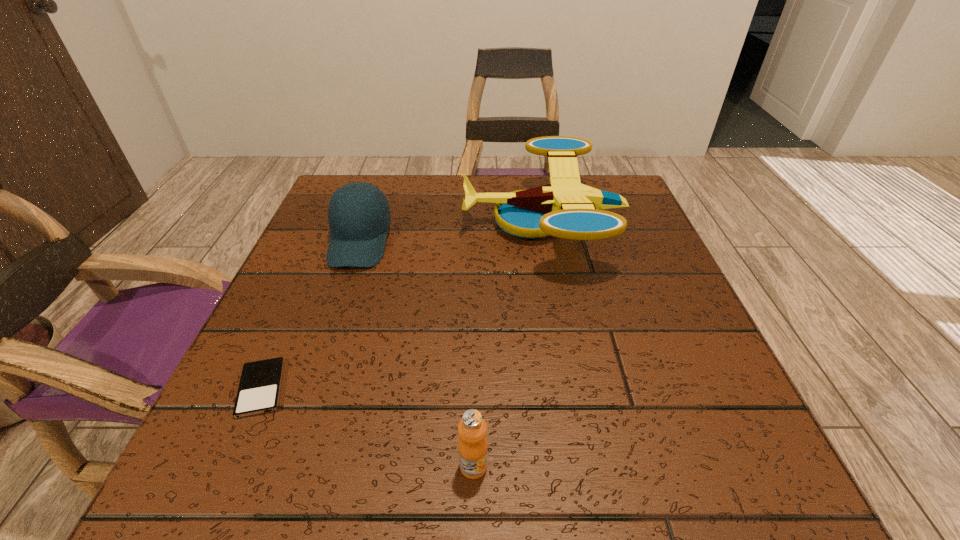
Locate an element on the screen. vacant space that is in between the drone and the nearest object is located at coordinates (508, 344).

Where is `free spot between the nearest object and the drone`? Image resolution: width=960 pixels, height=540 pixels. free spot between the nearest object and the drone is located at coordinates (508, 344).

Where is `free spot between the nearest object and the baseball cap`? Image resolution: width=960 pixels, height=540 pixels. free spot between the nearest object and the baseball cap is located at coordinates (417, 354).

The width and height of the screenshot is (960, 540). I want to click on free space between the shortest object and the baseball cap, so click(311, 315).

Find the location of a particular element. The width and height of the screenshot is (960, 540). unoccupied position between the drone and the nearest object is located at coordinates (508, 344).

You are a GUI agent. You are given a task and a screenshot of the screen. Output one action in this format:
    pyautogui.click(x=<x>, y=<y>)
    Task: Click on the object that stands as the third closest to the shortest object
    The image size is (960, 540).
    Given the screenshot: What is the action you would take?
    pyautogui.click(x=565, y=208)

Identify which object is the third closest to the baseball cap. Please provide its 2D coordinates. Your answer should be formatted as a tuple, i.e. [(x, y)], where the tuple contains the x and y coordinates of a point satisfying the conditions above.

[(473, 447)]

Find the location of a particular element. The width and height of the screenshot is (960, 540). vacant area that satisfies the following two spatial constraints: 1. at the cockpit of the drone; 2. on the front-facing side of the baseball cap is located at coordinates (546, 242).

Identify the location of vacant space that satisfies the following two spatial constraints: 1. at the cockpit of the drone; 2. on the front label of the nearest object. The image size is (960, 540). (588, 466).